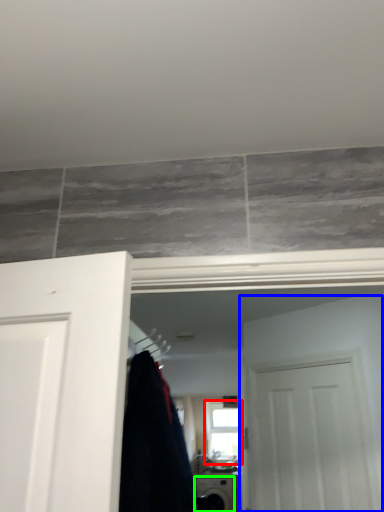
Question: Considering the real-world distances, which object is closest to window (highlighted by a red box)? door (highlighted by a blue box) or appliance (highlighted by a green box).

Choices:
 (A) door
 (B) appliance

Answer: (B)